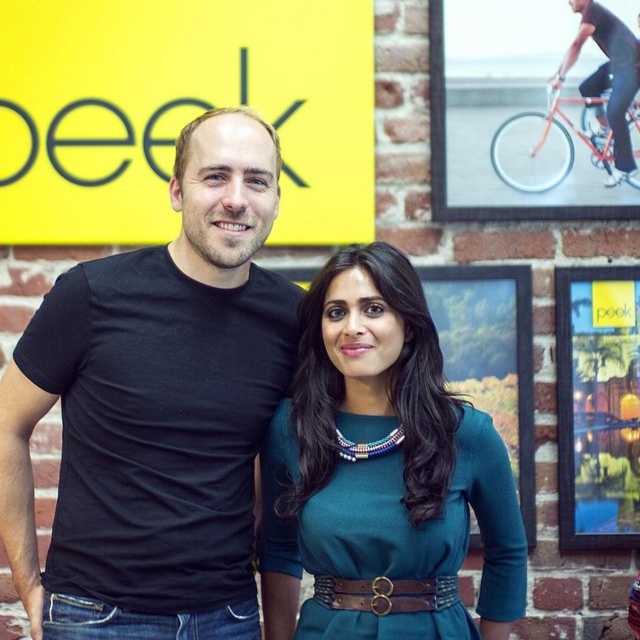
Question: Can you confirm if black cotton t-shirt at left is positioned below metallic bicycle at upper right?

Choices:
 (A) yes
 (B) no

Answer: (A)

Question: Where is yellow matte/blackboard at upper left located in relation to teal fabric dress at center in the image?

Choices:
 (A) above
 (B) below

Answer: (A)

Question: Among these points, which one is nearest to the camera?

Choices:
 (A) (436, 118)
 (B) (380, 582)
 (C) (120, 516)

Answer: (B)

Question: Which point is farther to the camera?

Choices:
 (A) (602, 209)
 (B) (445, 536)
 (C) (288, 45)
 (D) (428, 285)

Answer: (A)

Question: Which object appears closest to the camera in this image?

Choices:
 (A) metallic bicycle at upper right
 (B) yellow matte/blackboard at upper left
 (C) matte black shirt at upper right

Answer: (B)

Question: Is black cotton t-shirt at left thinner than matte black shirt at upper right?

Choices:
 (A) no
 (B) yes

Answer: (A)